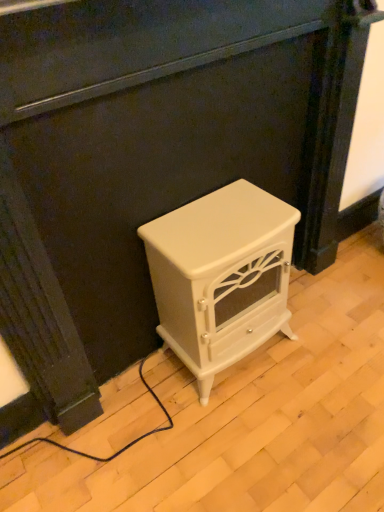
Describe the element at coordinates (221, 276) in the screenshot. I see `white glossy stove at center` at that location.

At what (x,y) coordinates should I click in order to perform the action: click on white glossy stove at center. Please return your answer as a coordinate pair (x, y). Looking at the image, I should click on (221, 276).

Where is `white glossy stove at center`? The image size is (384, 512). white glossy stove at center is located at coordinates (221, 276).